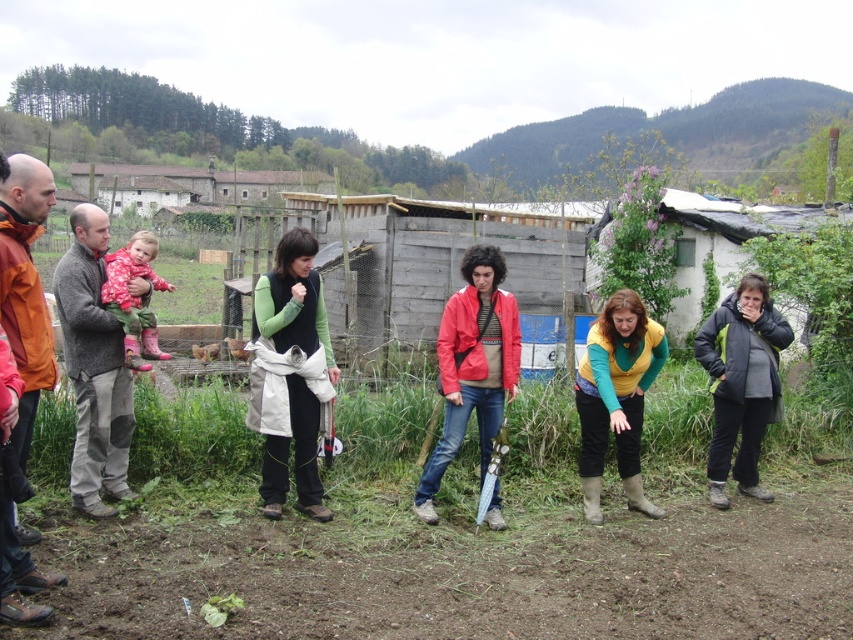
Question: Based on their relative distances, which object is nearer to the yellow-green sweater at center?

Choices:
 (A) orange matte jacket at left
 (B) knitted wool sweater at left

Answer: (B)

Question: Among these objects, which one is farthest from the camera?

Choices:
 (A) knitted wool sweater at left
 (B) yellow-green sweater at center
 (C) fluffy pink boots at left

Answer: (B)

Question: Is knitted wool sweater at left thinner than orange matte jacket at left?

Choices:
 (A) no
 (B) yes

Answer: (A)

Question: Is knitted wool sweater at left bigger than yellow-green sweater at center?

Choices:
 (A) yes
 (B) no

Answer: (A)

Question: Does knitted wool sweater at left have a larger size compared to fluffy pink boots at left?

Choices:
 (A) no
 (B) yes

Answer: (A)

Question: Which of the following is the farthest from the observer?

Choices:
 (A) (100, 390)
 (B) (27, 371)

Answer: (A)